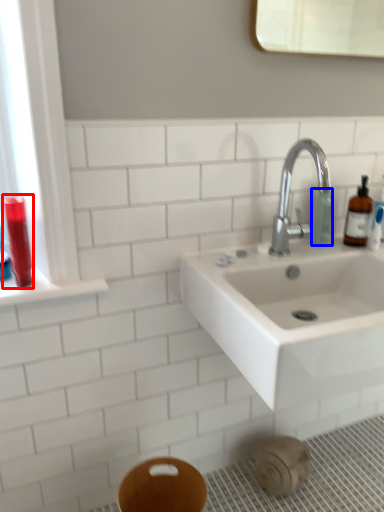
Question: Among these objects, which one is farthest to the camera, mouthwash (highlighted by a red box) or toiletry (highlighted by a blue box)?

Choices:
 (A) mouthwash
 (B) toiletry

Answer: (B)